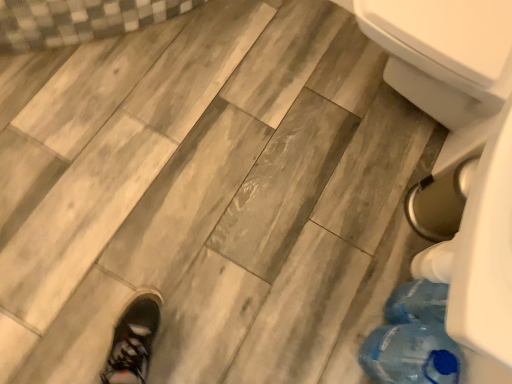
The image size is (512, 384). I want to click on free space in front of white plastic bidet at lower right, so click(338, 175).